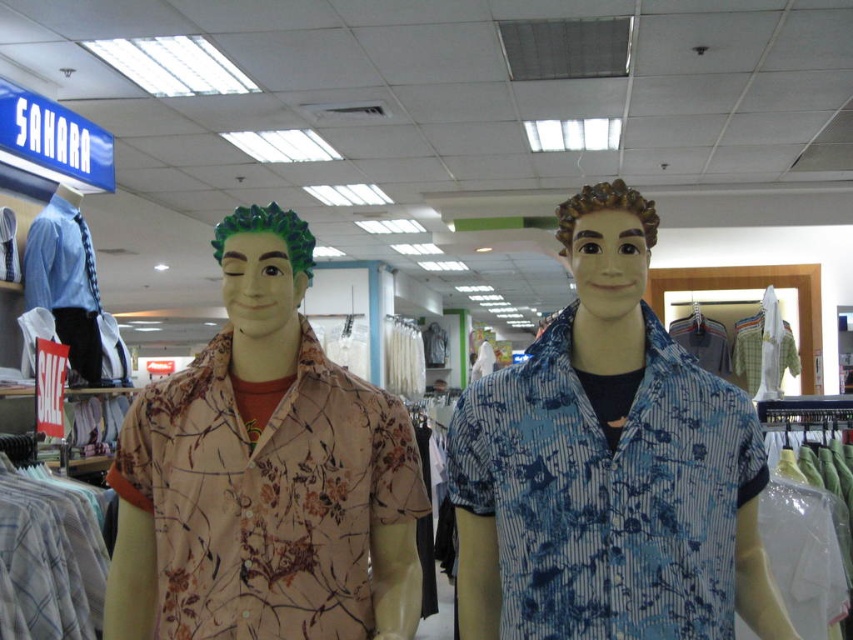
You are a customer in a clothing store looking at two shirts displayed on mannequins. You want to know which shirt is larger. The shirts are the blue striped shirt at center and the matte floral shirt at center. Can you tell me which one is bigger?

The matte floral shirt at center is larger than the blue striped shirt at center.

You are a customer in a clothing store holding a 12 inch long scarf. You want to place the scarf between the blue striped shirt at center and the matte floral shirt at center. Is there enough space between them to fit the scarf?

The blue striped shirt at center and the matte floral shirt at center are 12.44 inches apart. Since the scarf is 12 inches long, there is enough space to fit it between them.

You are a customer in the clothing store and want to find the mannequin with the floral shirt. You are standing at point (x=262, y=246). Which direction should you move to reach the mannequin at point (x=489, y=600)?

Since point (x=489, y=600) is behind point (x=262, y=246), you should move backward to reach the mannequin at point (x=489, y=600).